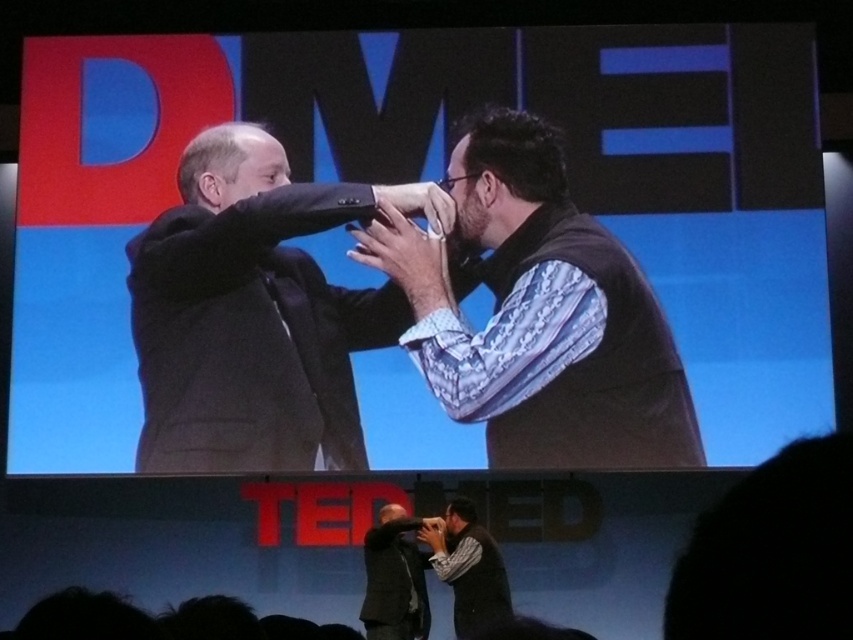
Question: Does matte black suit at upper center have a smaller size compared to dark gray suit at center?

Choices:
 (A) no
 (B) yes

Answer: (A)

Question: Is black suit at left positioned before dark gray suit at center?

Choices:
 (A) no
 (B) yes

Answer: (B)

Question: Among these points, which one is nearest to the camera?

Choices:
 (A) (463, 500)
 (B) (567, 442)
 (C) (349, 160)

Answer: (B)

Question: Does matte black suit at upper center appear on the right side of black suit at left?

Choices:
 (A) yes
 (B) no

Answer: (A)

Question: Among these objects, which one is nearest to the camera?

Choices:
 (A) patterned shirt at center
 (B) black suit at left
 (C) patterned fabric shirt at center
 (D) dark gray suit at center

Answer: (A)

Question: Estimate the real-world distances between objects in this image. Which object is farther from the patterned shirt at center?

Choices:
 (A) black suit at left
 (B) matte black suit at upper center
 (C) dark gray suit at center
 (D) patterned fabric shirt at center

Answer: (C)